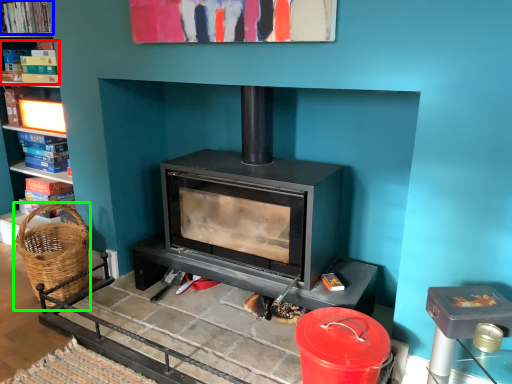
Question: Which is farther away from book (highlighted by a red box)? book (highlighted by a blue box) or basket (highlighted by a green box)?

Choices:
 (A) book
 (B) basket

Answer: (B)